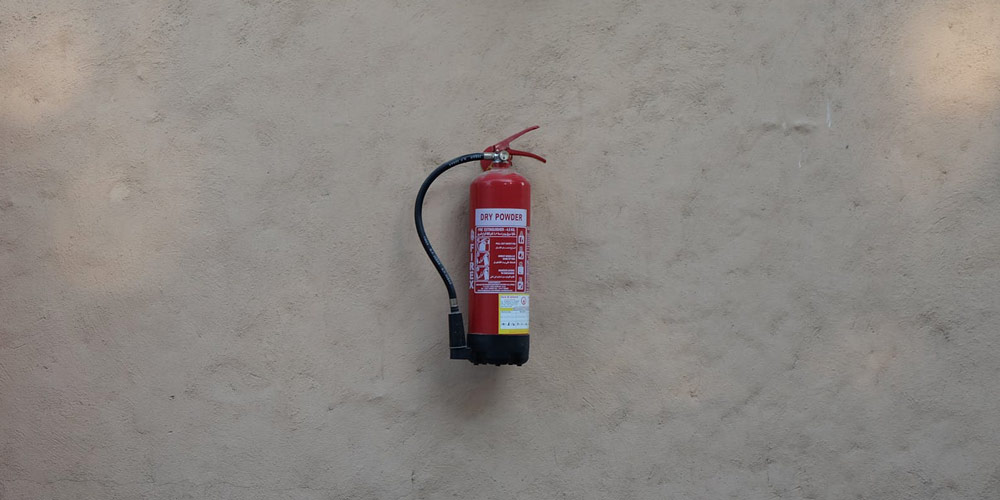
Find the location of a particular element. light is located at coordinates (947, 63).